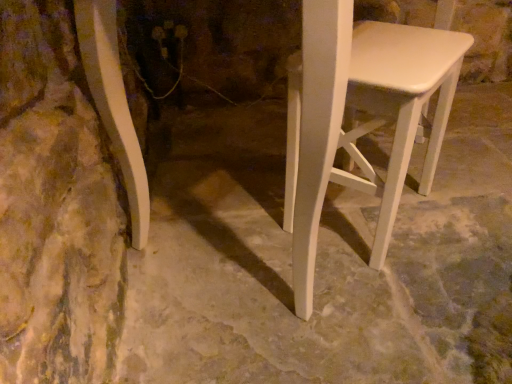
Question: From the image's perspective, is white matte concrete at center above or below white matte stool at right?

Choices:
 (A) below
 (B) above

Answer: (A)

Question: In terms of size, does white matte concrete at center appear bigger or smaller than white matte stool at right?

Choices:
 (A) small
 (B) big

Answer: (B)

Question: In terms of height, does white matte concrete at center look taller or shorter compared to white matte stool at right?

Choices:
 (A) short
 (B) tall

Answer: (A)

Question: Is white matte stool at right taller or shorter than white matte concrete at center?

Choices:
 (A) short
 (B) tall

Answer: (B)

Question: Is white matte stool at right inside the boundaries of white matte concrete at center, or outside?

Choices:
 (A) outside
 (B) inside

Answer: (A)

Question: From the image's perspective, is white matte stool at right positioned above or below white matte concrete at center?

Choices:
 (A) above
 (B) below

Answer: (A)

Question: Looking at the image, does white matte stool at right seem bigger or smaller compared to white matte concrete at center?

Choices:
 (A) small
 (B) big

Answer: (A)